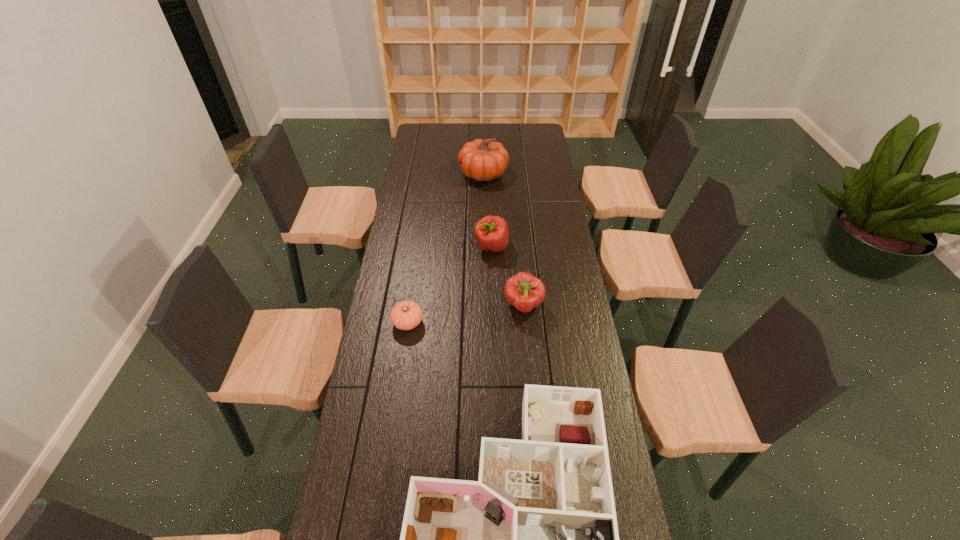
Where is `blank area located on the left of the nearer bell pepper`? The height and width of the screenshot is (540, 960). blank area located on the left of the nearer bell pepper is located at coordinates (436, 306).

What are the coordinates of `vacant space located 0.070m on the back of the tomato` in the screenshot? It's located at (412, 296).

Where is `object that is at the left edge`? This screenshot has height=540, width=960. object that is at the left edge is located at coordinates (406, 315).

At what (x,y) coordinates should I click in order to perform the action: click on object that is positioned at the right edge. Please return your answer as a coordinate pair (x, y). Image resolution: width=960 pixels, height=540 pixels. Looking at the image, I should click on (523, 291).

Find the location of a particular element. vacant space at the far edge of the desktop is located at coordinates (504, 139).

Identify the location of vacant space at the left edge. This screenshot has width=960, height=540. (395, 303).

At what (x,y) coordinates should I click in order to perform the action: click on free region at the right edge of the desktop. Please return your answer as a coordinate pair (x, y). Looking at the image, I should click on (540, 213).

This screenshot has width=960, height=540. Find the location of `vacant space at the far left corner of the desktop`. vacant space at the far left corner of the desktop is located at coordinates (423, 135).

The height and width of the screenshot is (540, 960). Identify the location of vacant area that lies between the leftmost object and the pumpkin. (445, 248).

At what (x,y) coordinates should I click in order to perform the action: click on blank region between the nearer bell pepper and the farther bell pepper. Please return your answer as a coordinate pair (x, y). The width and height of the screenshot is (960, 540). Looking at the image, I should click on coord(508,276).